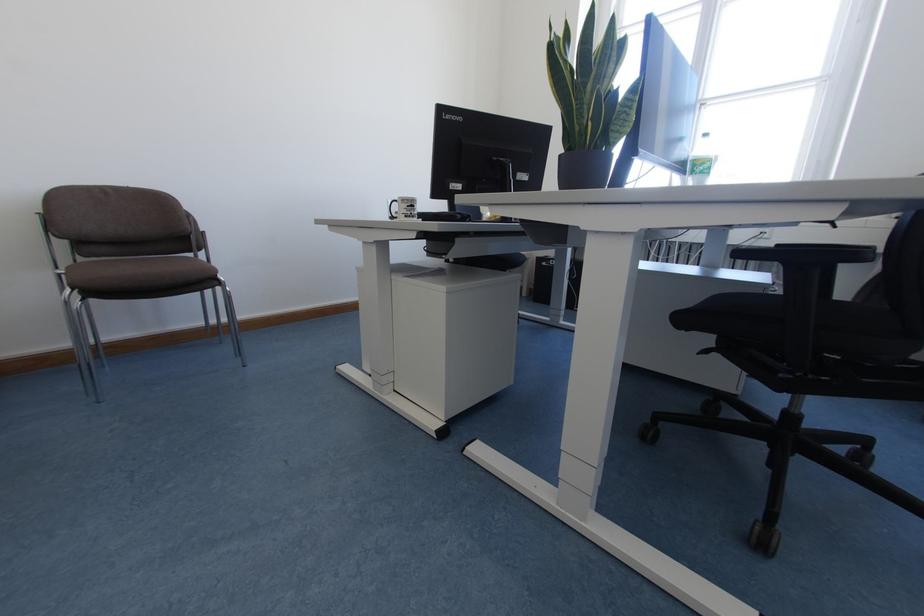
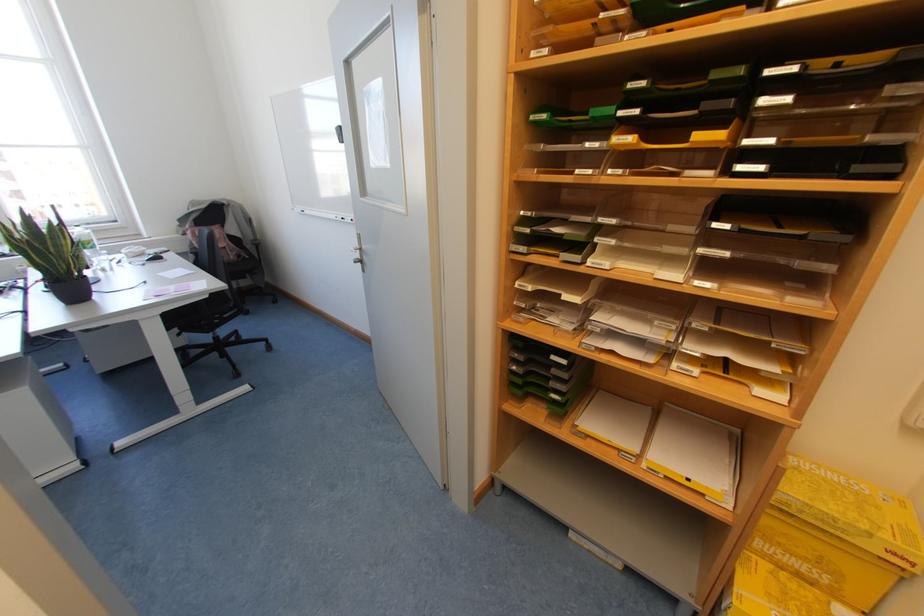
Locate, in the second image, the point that corresponds to the point at 759,544 in the first image.

(236, 375)